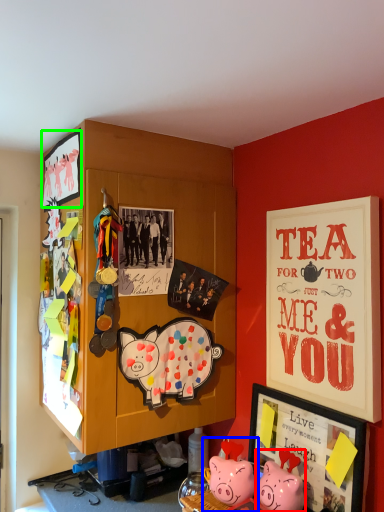
Question: Estimate the real-world distances between objects in this image. Which object is farther from toy (highlighted by a red box), toy (highlighted by a blue box) or picture frame (highlighted by a green box)?

Choices:
 (A) toy
 (B) picture frame

Answer: (B)